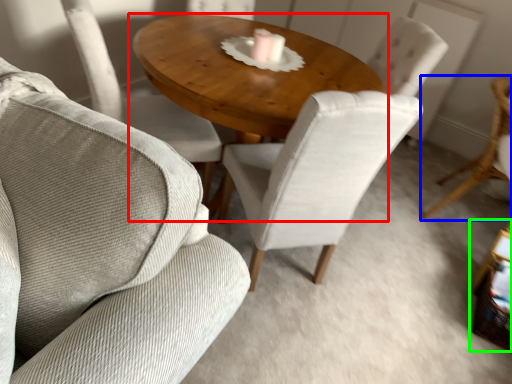
Question: Estimate the real-world distances between objects in this image. Which object is closer to coffee table (highlighted by a red box), chair (highlighted by a blue box) or side table (highlighted by a green box)?

Choices:
 (A) chair
 (B) side table

Answer: (A)